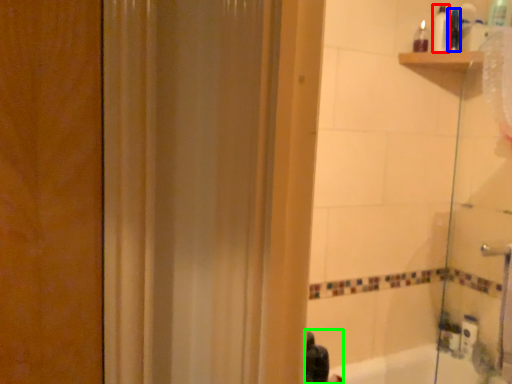
Question: Which object is the closest to the toiletry (highlighted by a red box)? Choose among these: toiletry (highlighted by a blue box) or person (highlighted by a green box).

Choices:
 (A) toiletry
 (B) person

Answer: (A)